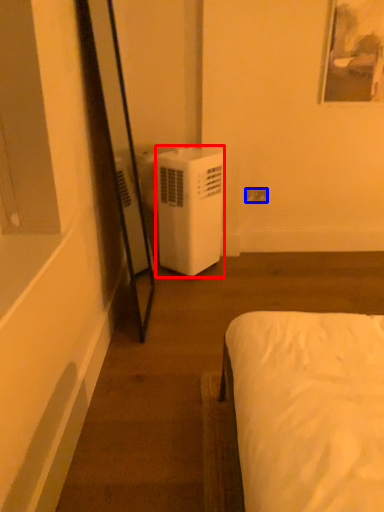
Question: Which object is further to the camera taking this photo, air conditioner (highlighted by a red box) or electric outlet (highlighted by a blue box)?

Choices:
 (A) air conditioner
 (B) electric outlet

Answer: (B)